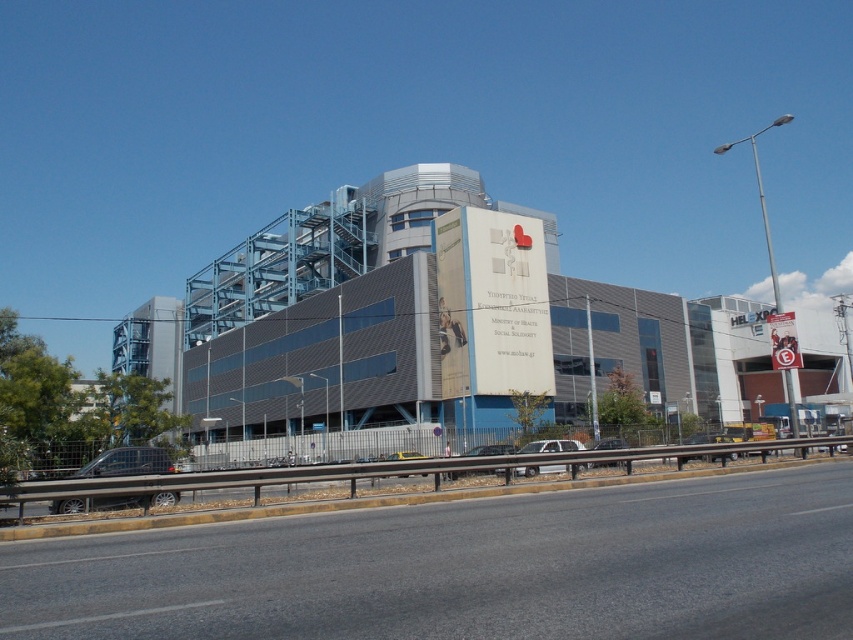
Question: Is white matte sedan at center to the left of yellow metallic taxi at center from the viewer's perspective?

Choices:
 (A) yes
 (B) no

Answer: (B)

Question: Which object is the farthest from the silver metallic sedan at center?

Choices:
 (A) metallic silver car at center
 (B) asphalt road at lower center
 (C) white matte sedan at center
 (D) metallic silver car at lower left

Answer: (D)

Question: Which is nearer to the metallic silver car at lower left?

Choices:
 (A) yellow metallic taxi at center
 (B) silver metallic sedan at center

Answer: (B)

Question: Is metallic silver car at center thinner than yellow metallic taxi at center?

Choices:
 (A) no
 (B) yes

Answer: (A)

Question: Can you confirm if metallic silver car at lower left is smaller than white matte sedan at center?

Choices:
 (A) yes
 (B) no

Answer: (A)

Question: Which object appears farthest from the camera in this image?

Choices:
 (A) white matte sedan at center
 (B) yellow metallic taxi at center
 (C) silver metallic sedan at center

Answer: (C)